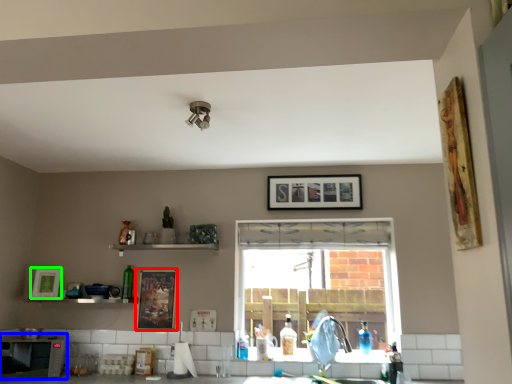
Question: Estimate the real-world distances between objects in this image. Which object is farther from picture frame (highlighted by a red box), appliance (highlighted by a blue box) or picture frame (highlighted by a green box)?

Choices:
 (A) appliance
 (B) picture frame

Answer: (B)